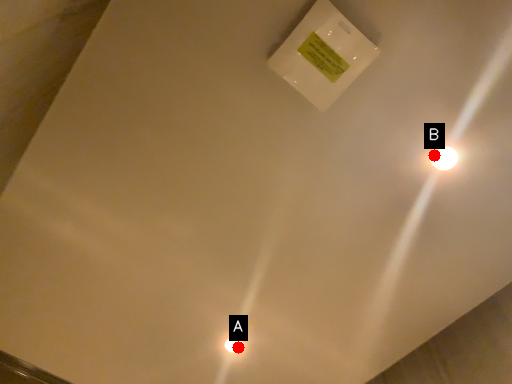
Question: Two points are circled on the image, labeled by A and B beside each circle. Which point is closer to the camera taking this photo?

Choices:
 (A) A is closer
 (B) B is closer

Answer: (B)